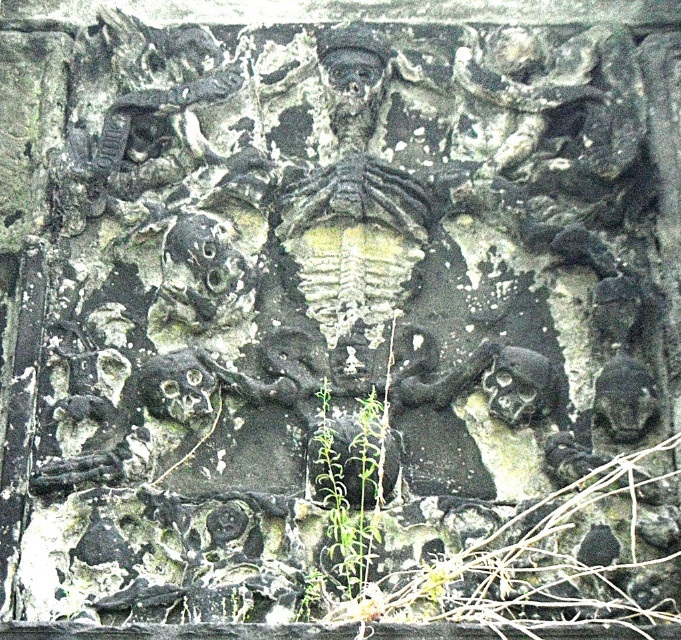
Measure the distance from green leafy plant at center to dark gray stone skull at lower right.

A distance of 9.39 meters exists between green leafy plant at center and dark gray stone skull at lower right.

Based on the photo, which of these two, green leafy plant at center or dark gray stone skull at lower right, stands shorter?

green leafy plant at center is shorter.

Who is more distant from viewer, (326, 552) or (614, 388)?

The point (614, 388) is more distant.

Find the location of a particular element. This screenshot has height=640, width=681. green leafy plant at center is located at coordinates (349, 493).